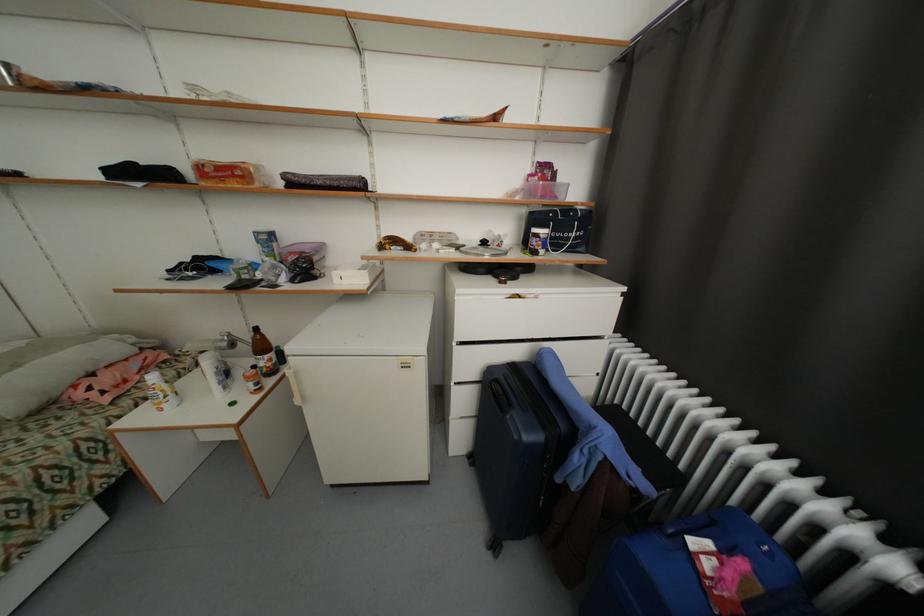
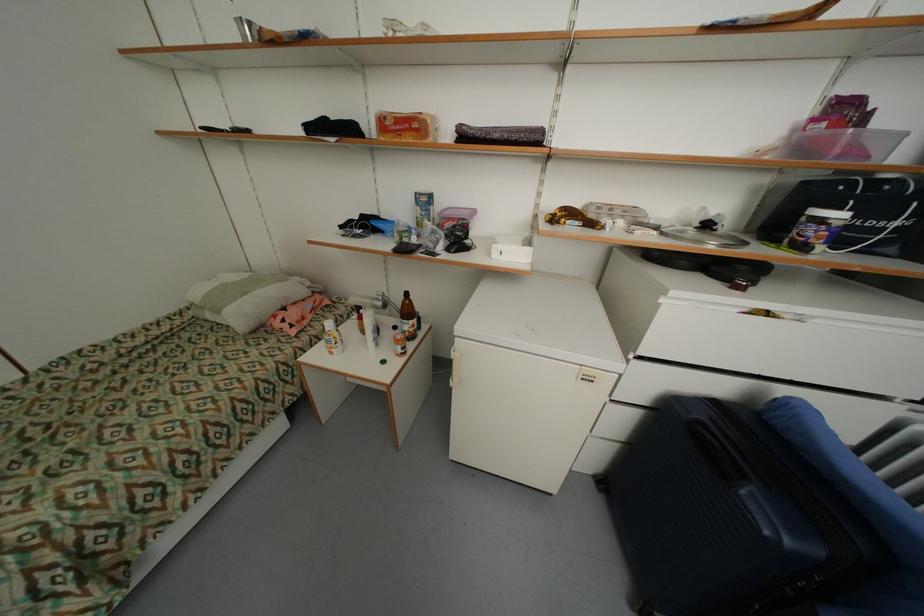
Locate, in the second image, the point that corresponds to point (343, 281) in the first image.

(502, 256)